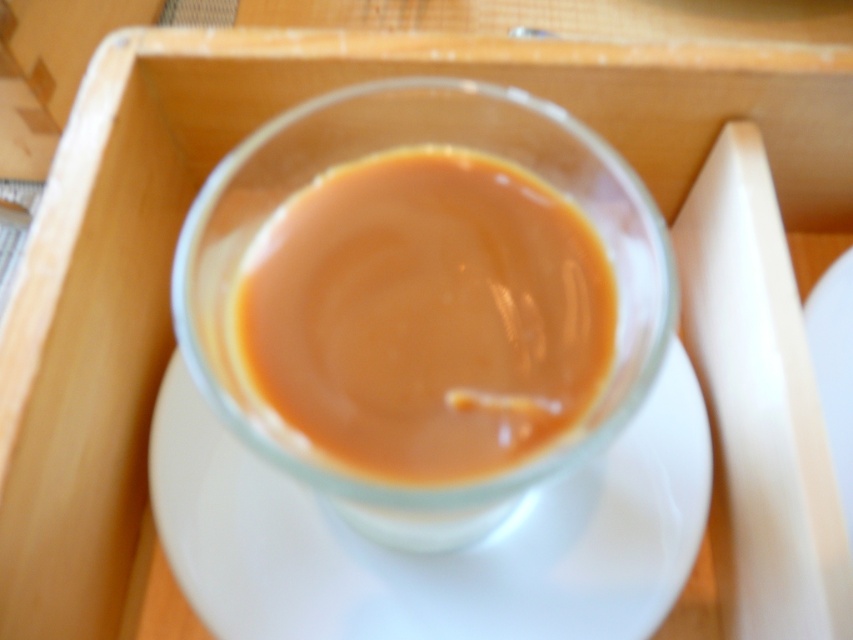
You are holding a smartphone and want to take a photo of the translucent glass cup at center. The cup is located at point (427, 316). If your phone camera has a field of view that can capture a 0.5x0.5 area centered at point 0.5, 0.5, will the cup be fully visible in the photo?

The translucent glass cup at center is located at point (427, 316), which is within the 0.5x0.5 area centered at 0.5, 0.5. Therefore, the cup will be fully visible in the photo.

You are setting up a small table for a tea ceremony. You have a translucent glass cup at center and a white ceramic saucer at center. Which object should you place first on the table to ensure the cup fits properly?

Since the translucent glass cup at center is smaller than the white ceramic saucer at center, you should place the white ceramic saucer at center first to ensure it can hold the cup properly.

You are holding a smartphone and want to take a photo of the translucent glass cup at center and the white ceramic saucer at center. Which object will appear larger in the photo?

The translucent glass cup at center will appear larger in the photo because it is closer to the viewer than the white ceramic saucer at center.